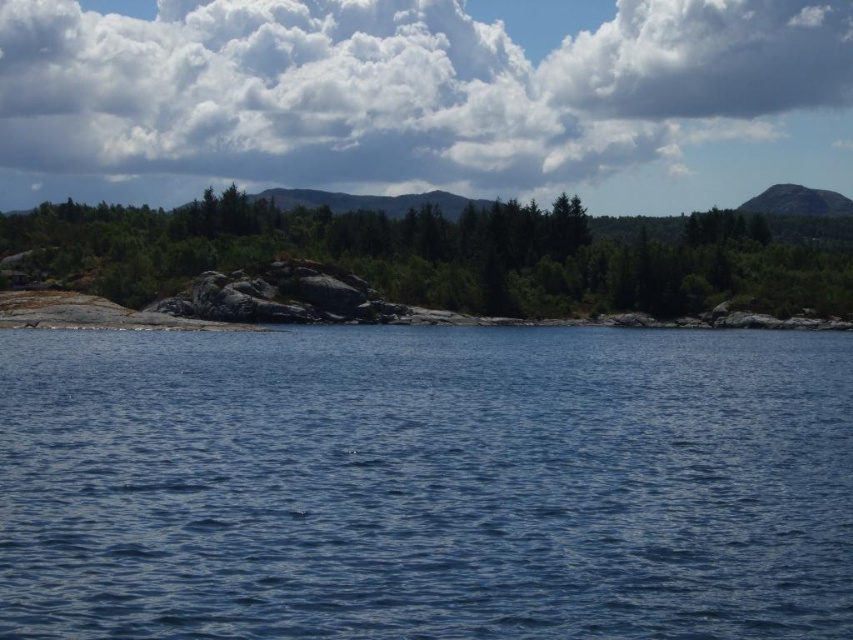
You are standing at the edge of the forest and see the blue liquid water at center and the green matte tree at center. Which object is closer to your right side?

The blue liquid water at center is positioned on the right side of green matte tree at center, so it is closer to your right side.

You are standing at the edge of the water in the image and want to walk to the green matte tree at center. Which direction should you head towards?

You should head towards the center of the image, where the green matte tree at center is located at coordinates point (450, 252).